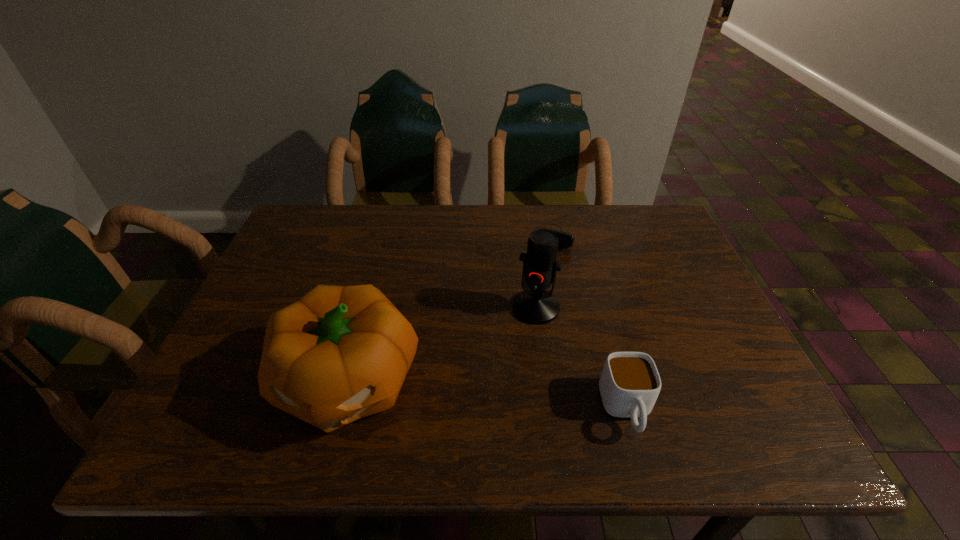
Where is `vacant space at the far left corner`? The height and width of the screenshot is (540, 960). vacant space at the far left corner is located at coordinates (315, 213).

Where is `vacant space at the far right corner`? The height and width of the screenshot is (540, 960). vacant space at the far right corner is located at coordinates (651, 205).

In order to click on free area in between the leftmost object and the farthest object in this screenshot , I will do `click(457, 306)`.

You are a GUI agent. You are given a task and a screenshot of the screen. Output one action in this format:
    pyautogui.click(x=<x>, y=<y>)
    Task: Click on the free space between the leftmost object and the farthest object
    The width and height of the screenshot is (960, 540).
    Given the screenshot: What is the action you would take?
    pyautogui.click(x=457, y=306)

This screenshot has width=960, height=540. Find the location of `free area in between the second shortest object and the farthest object`. free area in between the second shortest object and the farthest object is located at coordinates point(596,319).

Locate an element on the screen. vacant area between the farthest object and the leftmost object is located at coordinates (457, 306).

You are a GUI agent. You are given a task and a screenshot of the screen. Output one action in this format:
    pyautogui.click(x=<x>, y=<y>)
    Task: Click on the empty location between the webcam and the leftmost object
    This screenshot has height=540, width=960.
    Given the screenshot: What is the action you would take?
    pyautogui.click(x=457, y=306)

At what (x,y) coordinates should I click in order to perform the action: click on free space that is in between the webcam and the pumpkin. Please return your answer as a coordinate pair (x, y). Image resolution: width=960 pixels, height=540 pixels. Looking at the image, I should click on (457, 306).

Where is `free space between the shortest object and the cup`? This screenshot has width=960, height=540. free space between the shortest object and the cup is located at coordinates (596, 319).

The height and width of the screenshot is (540, 960). In order to click on empty space that is in between the farthest object and the pumpkin in this screenshot , I will do `click(457, 306)`.